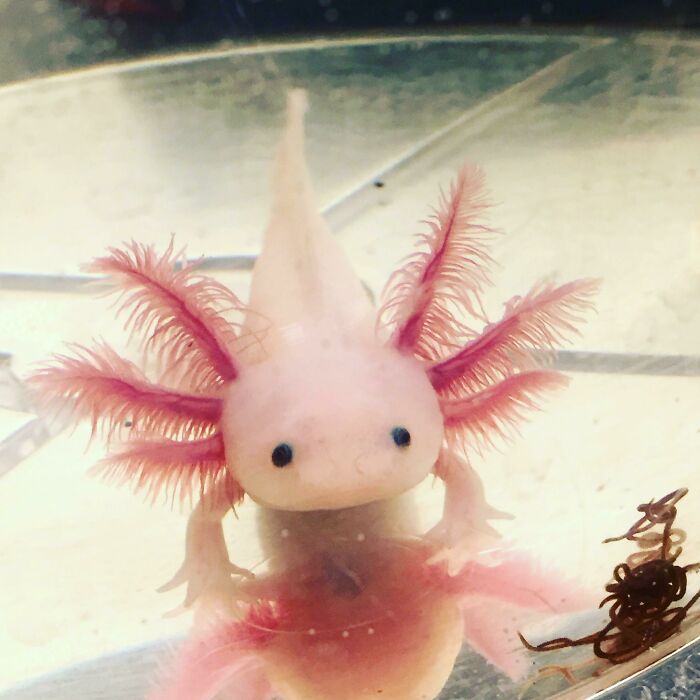
I want to click on light, so click(x=570, y=248).